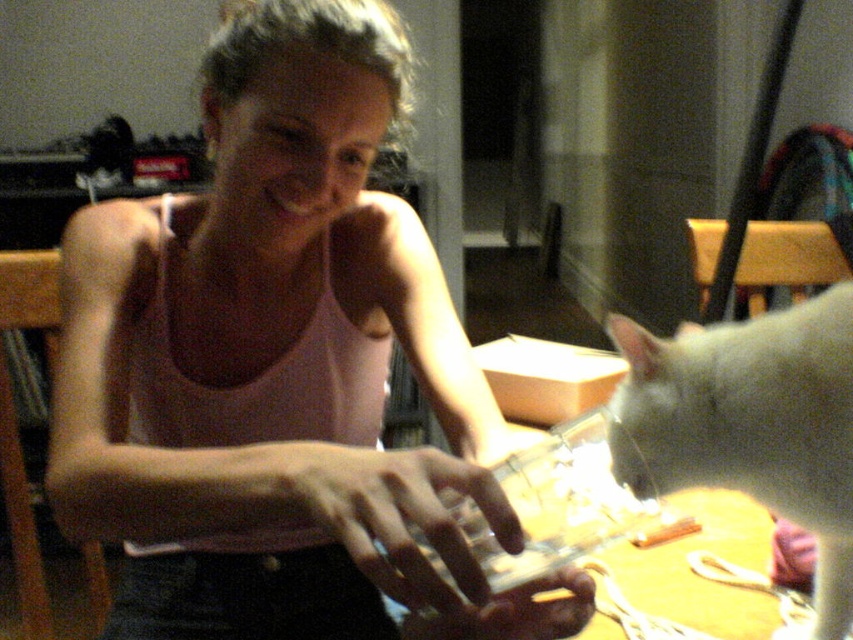
You are a fashion designer observing the scene. You need to compare the width of the pink matte tank top at center and the white fur cat at lower right. Which one is wider?

The pink matte tank top at center is wider than the white fur cat at lower right.

You are standing in the room and want to locate the pink matte tank top at center. According to the image, where is it positioned in terms of coordinates?

The pink matte tank top at center is located at coordinates point (277, 364).

You are a photographer trying to capture the pink matte tank top at center and the white fur cat at lower right in the same frame. Since the tank top is closer to you than the cat, will you need to adjust your focus to ensure both are in focus?

The pink matte tank top at center is closer to the viewer than the white fur cat at lower right, so you will need to adjust your focus to ensure both are in focus.